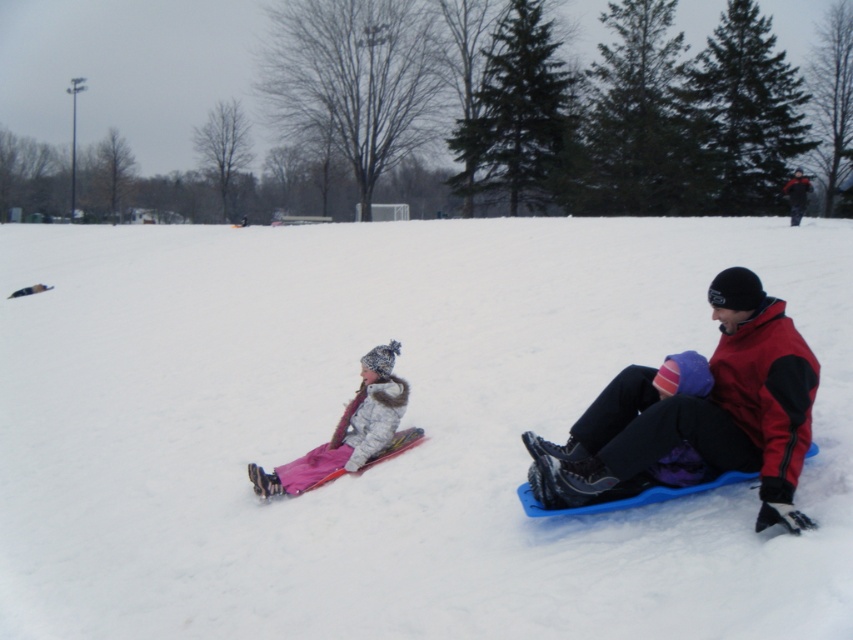
Identify the location of red fleece jacket at lower right. (698, 413).

Does red fleece jacket at lower right appear over pink fleece snowsuit at left?

Indeed, red fleece jacket at lower right is positioned over pink fleece snowsuit at left.

Locate an element on the screen. This screenshot has width=853, height=640. red fleece jacket at lower right is located at coordinates (698, 413).

Does white fluffy snow at center have a larger size compared to pink fleece snowsuit at left?

Yes.

Is white fluffy snow at center smaller than pink fleece snowsuit at left?

Actually, white fluffy snow at center might be larger than pink fleece snowsuit at left.

Who is more distant from viewer, (316, 260) or (253, 468)?

The point (316, 260) is more distant.

Locate an element on the screen. The image size is (853, 640). white fluffy snow at center is located at coordinates (399, 426).

Between point (579, 346) and point (695, 452), which one is positioned in front?

Positioned in front is point (695, 452).

This screenshot has width=853, height=640. Describe the element at coordinates (399, 426) in the screenshot. I see `white fluffy snow at center` at that location.

Locate an element on the screen. white fluffy snow at center is located at coordinates (399, 426).